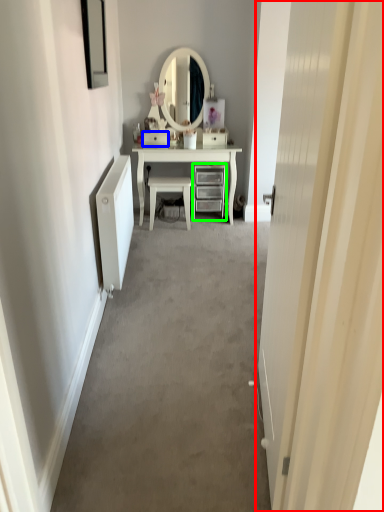
Question: Estimate the real-world distances between objects in this image. Which object is closer to door (highlighted by a red box), drawer (highlighted by a blue box) or chest of drawers (highlighted by a green box)?

Choices:
 (A) drawer
 (B) chest of drawers

Answer: (B)